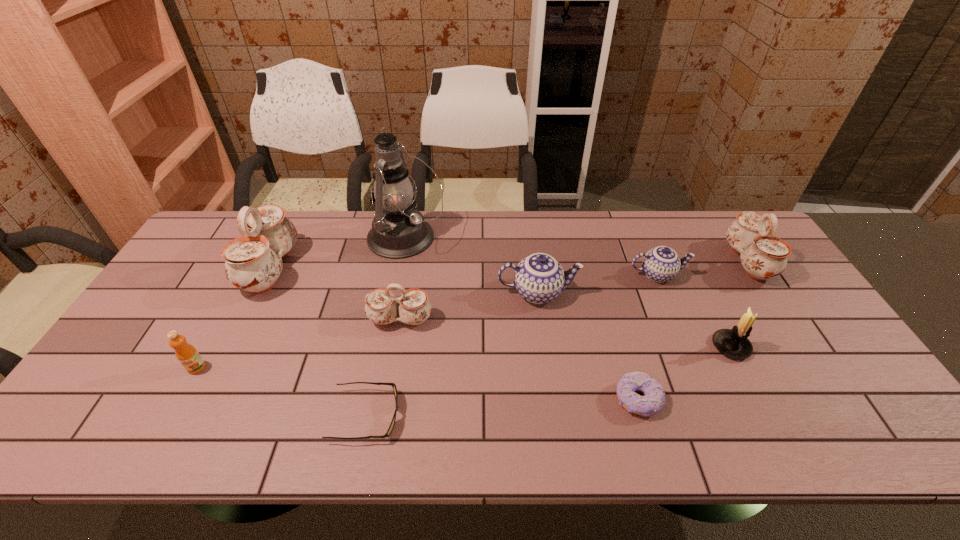
At what (x,y) coordinates should I click in order to perform the action: click on the tallest object. Please return your answer as a coordinate pair (x, y). This screenshot has width=960, height=540. Looking at the image, I should click on (399, 231).

Image resolution: width=960 pixels, height=540 pixels. Identify the location of the leftmost white chinaware. (253, 262).

Where is `the tallest chinaware`? The image size is (960, 540). the tallest chinaware is located at coordinates (253, 262).

Find the location of a particular element. the rightmost object is located at coordinates (763, 256).

Identify the location of the rightmost chinaware. Image resolution: width=960 pixels, height=540 pixels. [x=763, y=256].

This screenshot has width=960, height=540. In order to click on white candle holder in this screenshot , I will do `click(734, 343)`.

This screenshot has height=540, width=960. I want to click on the third chinaware from left to right, so [x=539, y=278].

You are a GUI agent. You are given a task and a screenshot of the screen. Output one action in this format:
    pyautogui.click(x=<x>, y=<y>)
    Task: Click on the bigger blue chinaware
    This screenshot has width=960, height=540.
    Given the screenshot: What is the action you would take?
    pyautogui.click(x=539, y=278)

Where is `the second white chinaware from right to left`? the second white chinaware from right to left is located at coordinates (381, 308).

The height and width of the screenshot is (540, 960). Identify the location of the nearest white chinaware. (381, 308).